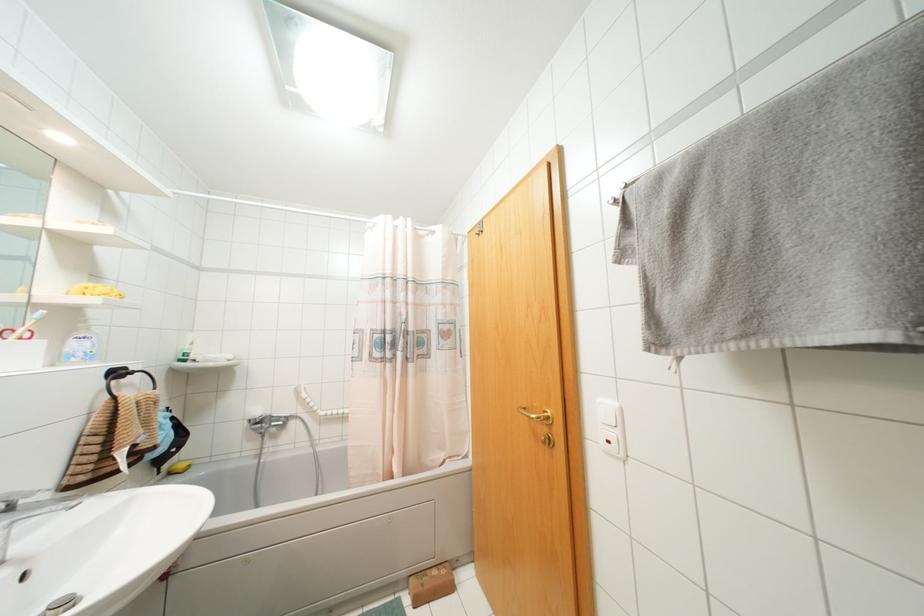
Where would you push the white light switch? Please return your answer as a coordinate pair (x, y).

(609, 415)